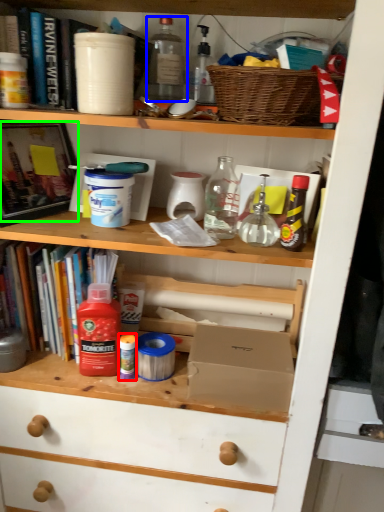
Question: Which object is positioned farthest from bottle (highlighted by a red box)? Select from bottle (highlighted by a blue box) and book (highlighted by a green box).

Choices:
 (A) bottle
 (B) book

Answer: (A)